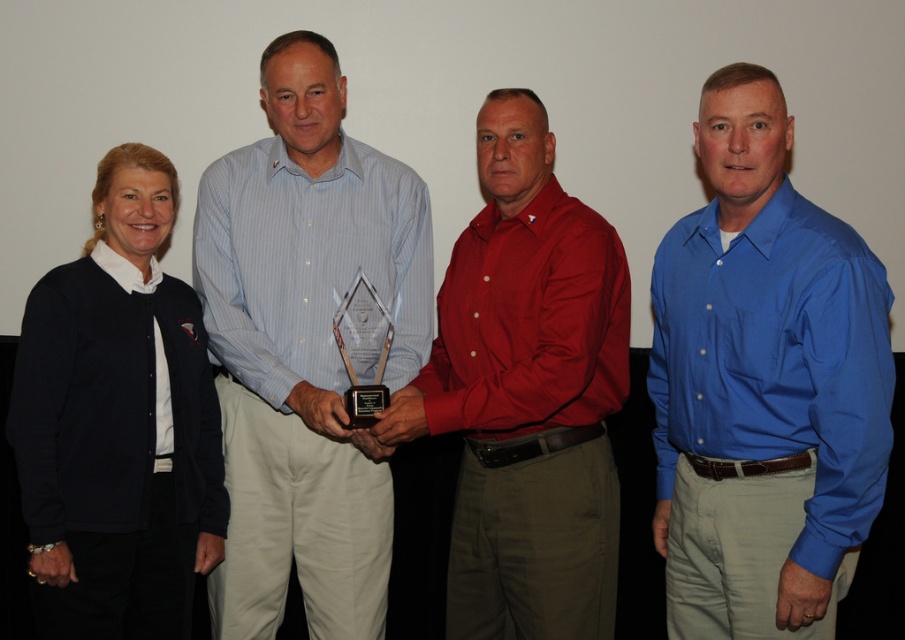
Who is shorter, blue smooth shirt at right or shiny red shirt at center?

blue smooth shirt at right

Is blue smooth shirt at right positioned behind shiny red shirt at center?

No.

Is point (744, 310) behind point (481, 228)?

No, it is in front of (481, 228).

This screenshot has width=905, height=640. I want to click on blue smooth shirt at right, so click(x=763, y=385).

Does point (258, 285) come in front of point (62, 284)?

No, (258, 285) is behind (62, 284).

Describe the element at coordinates (305, 348) in the screenshot. I see `blue striped shirt at center` at that location.

What are the coordinates of `blue striped shirt at center` in the screenshot? It's located at pyautogui.click(x=305, y=348).

Where is `blue striped shirt at center`? blue striped shirt at center is located at coordinates (305, 348).

Which is more to the right, blue striped shirt at center or shiny red shirt at center?

Positioned to the right is shiny red shirt at center.

Between blue striped shirt at center and shiny red shirt at center, which one has less height?

shiny red shirt at center is shorter.

Is point (335, 298) less distant than point (543, 310)?

That is False.

Identify the location of blue striped shirt at center. This screenshot has width=905, height=640. (305, 348).